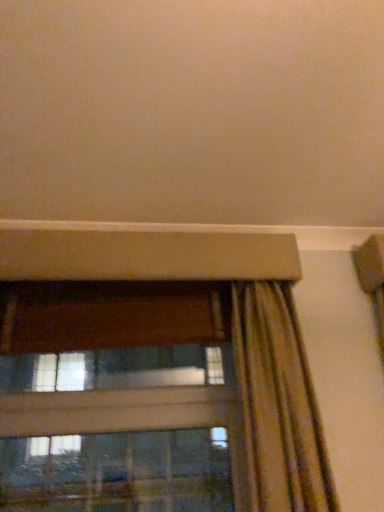
Question: Is striped fabric curtain at lower right wider or thinner than transparent glass window at lower left?

Choices:
 (A) wide
 (B) thin

Answer: (A)

Question: From the image's perspective, is striped fabric curtain at lower right above or below transparent glass window at lower left?

Choices:
 (A) below
 (B) above

Answer: (B)

Question: In the image, is striped fabric curtain at lower right on the left side or the right side of transparent glass window at lower left?

Choices:
 (A) right
 (B) left

Answer: (A)

Question: Would you say transparent glass window at lower left is to the left or to the right of striped fabric curtain at lower right in the picture?

Choices:
 (A) right
 (B) left

Answer: (B)

Question: Is point [x=304, y=349] positioned closer to the camera than point [x=334, y=500]?

Choices:
 (A) farther
 (B) closer

Answer: (A)

Question: Considering the positions of transparent glass window at lower left and striped fabric curtain at lower right in the image, is transparent glass window at lower left bigger or smaller than striped fabric curtain at lower right?

Choices:
 (A) big
 (B) small

Answer: (A)

Question: Relative to striped fabric curtain at lower right, is transparent glass window at lower left in front or behind?

Choices:
 (A) behind
 (B) front

Answer: (A)